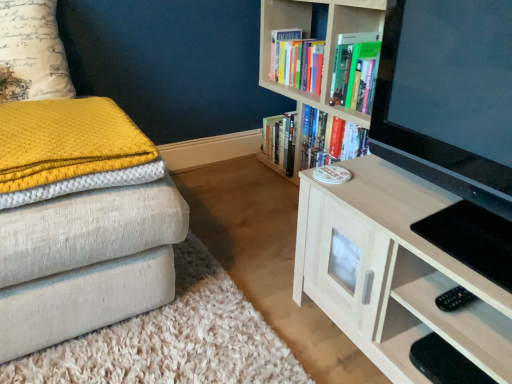
Question: In the image, is black plastic remote control at lower right on the left side or the right side of hardcover books at upper center, the 1th book positioned from the top?

Choices:
 (A) left
 (B) right

Answer: (B)

Question: Do you think black plastic remote control at lower right is within hardcover books at upper center, the 1th book positioned from the top, or outside of it?

Choices:
 (A) outside
 (B) inside

Answer: (A)

Question: Which of these objects is positioned closest to the hardcover books at center, the first book when ordered from bottom to top?

Choices:
 (A) hardcover books at upper center, acting as the 2th book starting from the bottom
 (B) black plastic remote control at lower right
 (C) light wood cabinet at center, which appears as the second bookcase when viewed from the back
 (D) yellow textured blanket at left
 (E) wooden bookcase at upper right, the 1th bookcase positioned from the back

Answer: (E)

Question: Which is nearer to the light wood cabinet at center, marked as the 1th bookcase in a front-to-back arrangement?

Choices:
 (A) wooden bookcase at upper right, the 1th bookcase positioned from the back
 (B) hardcover books at upper center, the 1th book positioned from the top
 (C) black plastic remote control at lower right
 (D) yellow textured pillow at upper left
 (E) hardcover books at center, the 2th book viewed from the top

Answer: (C)